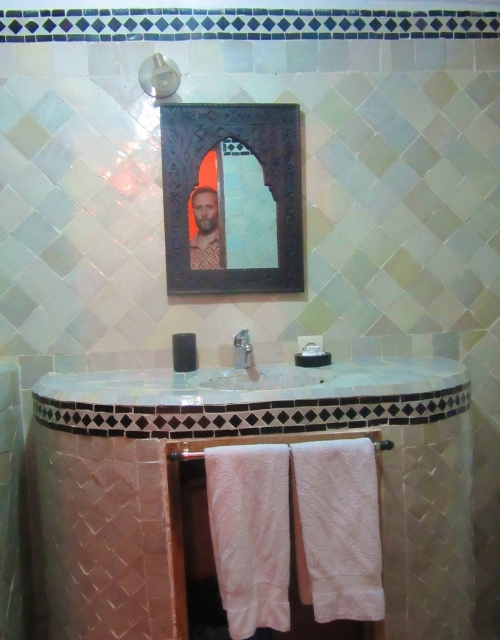
Can you confirm if white glossy sink at center is positioned above patterned fabric man at center?

Actually, white glossy sink at center is below patterned fabric man at center.

Measure the distance from white glossy sink at center to patterned fabric man at center.

white glossy sink at center is 14.62 inches away from patterned fabric man at center.

Between point (213, 388) and point (213, 198), which one is positioned behind?

Positioned behind is point (213, 198).

Find the location of `white glossy sink at center`. white glossy sink at center is located at coordinates (267, 378).

Between point (214, 192) and point (140, 67), which one is positioned behind?

The point (214, 192) is more distant.

Who is higher up, patterned fabric man at center or metallic silver shower head at upper center?

Positioned higher is metallic silver shower head at upper center.

Is point (213, 216) in front of point (169, 92)?

No, it is behind (169, 92).

Identify the location of patterned fabric man at center. (205, 228).

Measure the distance between dark wood mirror at upper center and wooden towel bar at center.

A distance of 31.93 inches exists between dark wood mirror at upper center and wooden towel bar at center.

Is dark wood mirror at upper center to the left of wooden towel bar at center from the viewer's perspective?

No, dark wood mirror at upper center is not to the left of wooden towel bar at center.

Between point (181, 157) and point (173, 452), which one is positioned behind?

The point (181, 157) is behind.

What are the coordinates of `dark wood mirror at upper center` in the screenshot? It's located at (264, 179).